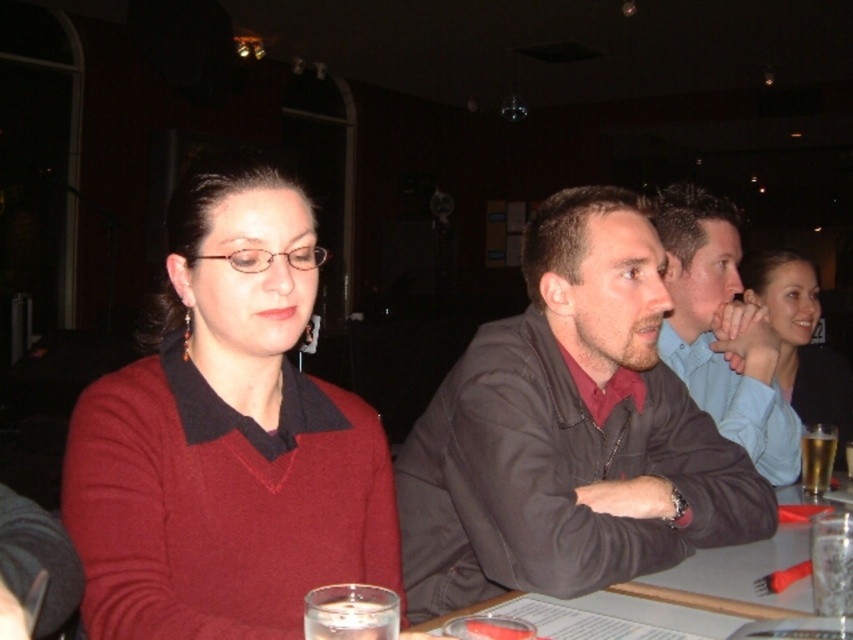
Consider the image. You are standing in the center of the room and want to walk to the smooth wooden table at center. Which direction should you walk?

The smooth wooden table at center is located at point (732, 579), so you should walk towards the direction of the table which is at that coordinate.

You are sitting at the smooth wooden table at center and want to hand a napkin to the person wearing the matte black sweater at center. Can you reach them without moving from your seat?

The smooth wooden table at center is in front of matte black sweater at center, so you can reach them by extending your arm over the table.